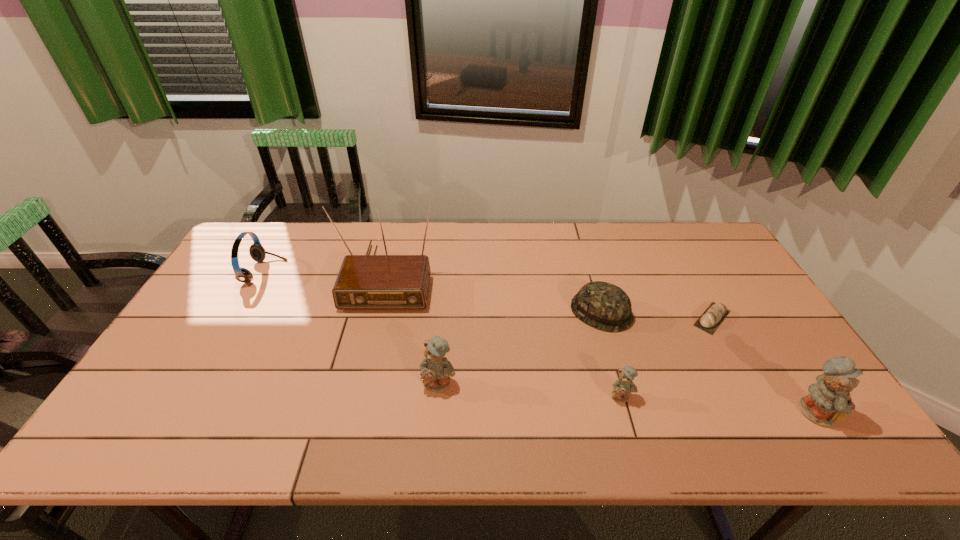
At what (x,y) coordinates should I click in order to perform the action: click on the leftmost teddy bear. Please return your answer as a coordinate pair (x, y). The width and height of the screenshot is (960, 540). Looking at the image, I should click on (436, 370).

Where is `the shortest teddy bear`? the shortest teddy bear is located at coordinates click(x=624, y=385).

This screenshot has height=540, width=960. Find the location of `the rightmost teddy bear`. the rightmost teddy bear is located at coordinates (829, 401).

The height and width of the screenshot is (540, 960). I want to click on headset, so click(257, 252).

Identify the location of headwear. (605, 306).

You are a GUI agent. You are given a task and a screenshot of the screen. Output one action in this format:
    pyautogui.click(x=<x>, y=<y>)
    Task: Click on the tallest object
    The width and height of the screenshot is (960, 540).
    Given the screenshot: What is the action you would take?
    pyautogui.click(x=365, y=282)

Find the location of `the shortest object`. the shortest object is located at coordinates (714, 315).

At what (x,y) coordinates should I click in order to perform the action: click on the second object from right to left. Please return your answer as a coordinate pair (x, y). Looking at the image, I should click on (714, 315).

What are the coordinates of `vacant area situated with the microphone attached to the side of the headset` in the screenshot? It's located at (307, 272).

This screenshot has height=540, width=960. In order to click on vacant space located 0.190m on the front of the headwear in this screenshot , I will do `click(624, 391)`.